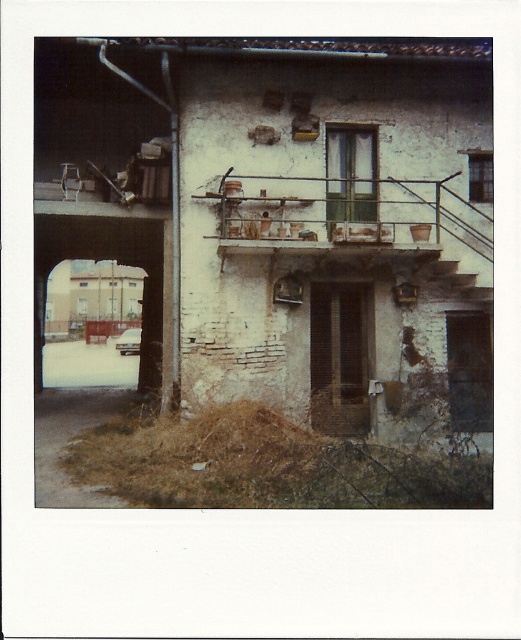
Is rustic wooden balcony at center to the right of wooden staircase at center from the viewer's perspective?

Incorrect, rustic wooden balcony at center is not on the right side of wooden staircase at center.

This screenshot has height=640, width=521. Describe the element at coordinates (346, 214) in the screenshot. I see `rustic wooden balcony at center` at that location.

Locate an element on the screen. The height and width of the screenshot is (640, 521). rustic wooden balcony at center is located at coordinates click(x=346, y=214).